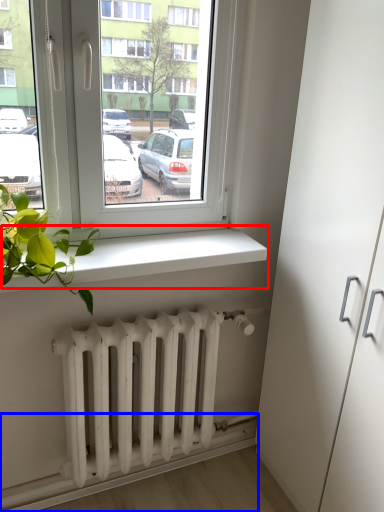
Question: Which object appears closest to the camera in this image, window sill (highlighted by a red box) or ledge (highlighted by a blue box)?

Choices:
 (A) window sill
 (B) ledge

Answer: (A)